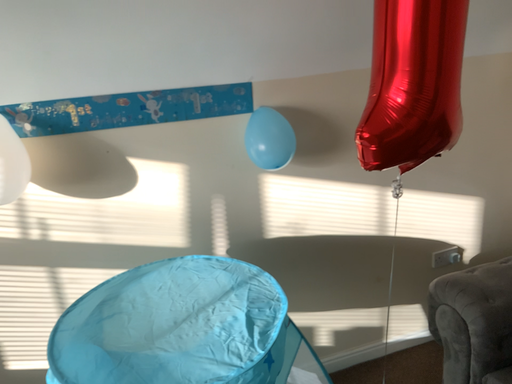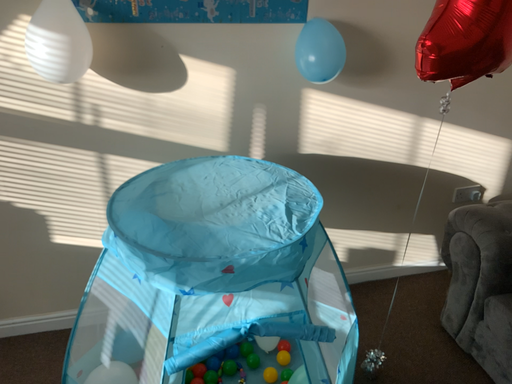
Question: How did the camera likely rotate when shooting the video?

Choices:
 (A) rotated upward
 (B) rotated downward

Answer: (B)